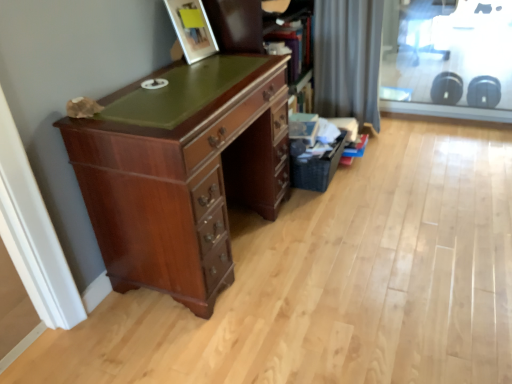
Question: Is transparent glass screen door at upper right taller than mahogany wood desk at left?

Choices:
 (A) no
 (B) yes

Answer: (B)

Question: Considering the relative positions of transparent glass screen door at upper right and mahogany wood desk at left in the image provided, is transparent glass screen door at upper right to the right of mahogany wood desk at left from the viewer's perspective?

Choices:
 (A) no
 (B) yes

Answer: (B)

Question: Could mahogany wood desk at left be considered to be inside transparent glass screen door at upper right?

Choices:
 (A) yes
 (B) no

Answer: (B)

Question: From a real-world perspective, is transparent glass screen door at upper right positioned over mahogany wood desk at left based on gravity?

Choices:
 (A) no
 (B) yes

Answer: (B)

Question: Is transparent glass screen door at upper right oriented towards mahogany wood desk at left?

Choices:
 (A) yes
 (B) no

Answer: (A)

Question: Is transparent glass screen door at upper right next to mahogany wood desk at left?

Choices:
 (A) no
 (B) yes

Answer: (A)

Question: Is mahogany wood desk at left turned away from black woven basket at lower right?

Choices:
 (A) yes
 (B) no

Answer: (B)

Question: From the image's perspective, is mahogany wood desk at left above black woven basket at lower right?

Choices:
 (A) yes
 (B) no

Answer: (B)

Question: Is mahogany wood desk at left oriented towards black woven basket at lower right?

Choices:
 (A) no
 (B) yes

Answer: (A)

Question: Is mahogany wood desk at left wider than black woven basket at lower right?

Choices:
 (A) no
 (B) yes

Answer: (B)

Question: From a real-world perspective, is mahogany wood desk at left under black woven basket at lower right?

Choices:
 (A) no
 (B) yes

Answer: (A)

Question: Is mahogany wood desk at left next to black woven basket at lower right?

Choices:
 (A) no
 (B) yes

Answer: (A)

Question: Does black woven basket at lower right appear on the left side of gray fabric curtain at upper right?

Choices:
 (A) no
 (B) yes

Answer: (B)